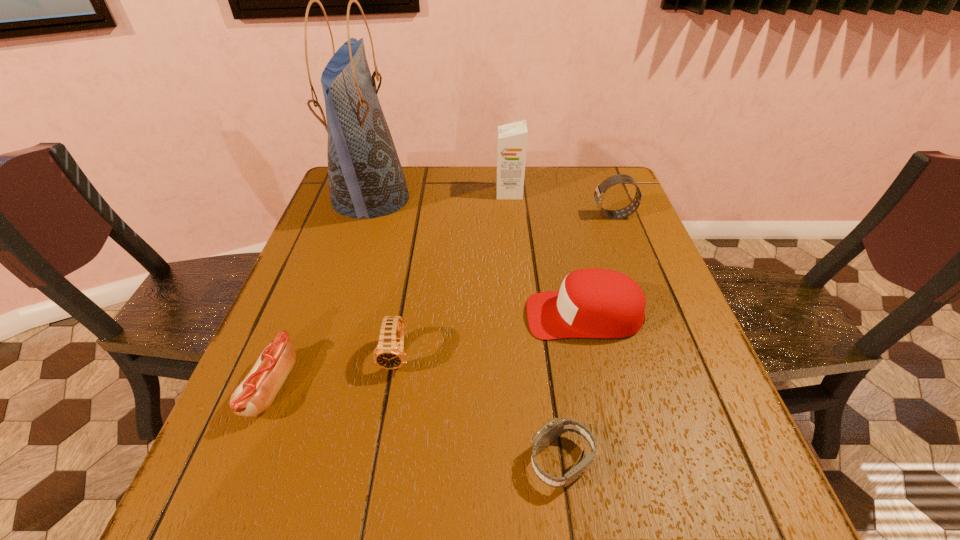
Identify the location of object that is at the far left corner. The width and height of the screenshot is (960, 540). (312, 539).

Choose which object is the fourth nearest neighbor to the sausage. Please provide its 2D coordinates. Your answer should be formatted as a tuple, i.e. [(x, y)], where the tuple contains the x and y coordinates of a point satisfying the conditions above.

[(312, 539)]

You are a GUI agent. You are given a task and a screenshot of the screen. Output one action in this format:
    pyautogui.click(x=<x>, y=<y>)
    Task: Click on the object that stands as the fourth closest to the carton
    The image size is (960, 540).
    Given the screenshot: What is the action you would take?
    pyautogui.click(x=312, y=539)

You are a GUI agent. You are given a task and a screenshot of the screen. Output one action in this format:
    pyautogui.click(x=<x>, y=<y>)
    Task: Click on the watch that stands as the third closest to the sausage
    The image size is (960, 540).
    Given the screenshot: What is the action you would take?
    pyautogui.click(x=312, y=539)

This screenshot has width=960, height=540. In order to click on watch object that ranks as the closest to the nearest watch in this screenshot , I will do click(x=312, y=539).